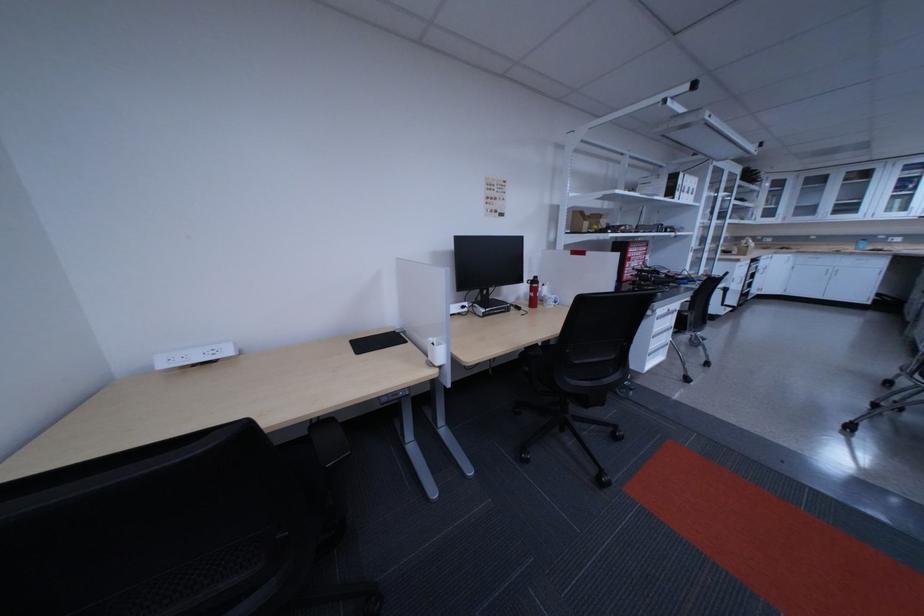
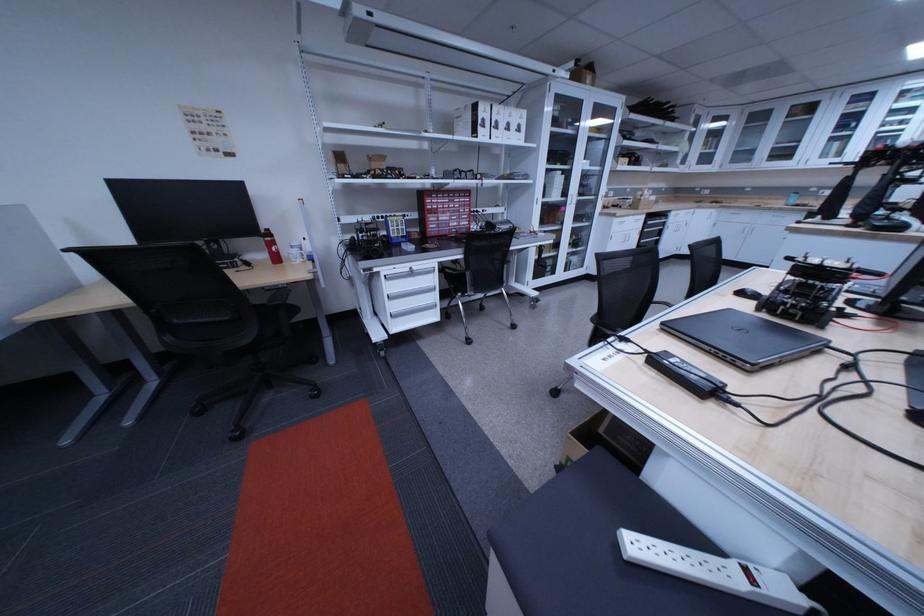
Question: The images are taken continuously from a first-person perspective. In which direction are you moving?

Choices:
 (A) Left
 (B) Right
 (C) Forward
 (D) Backward

Answer: (B)